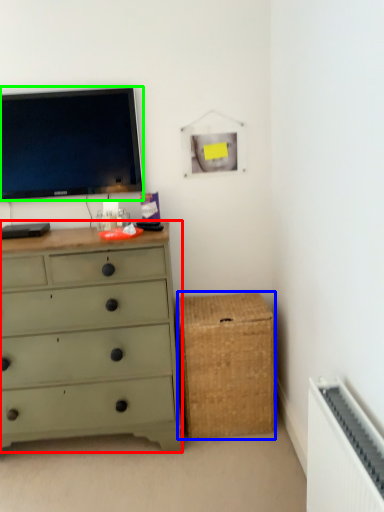
Question: Considering the real-world distances, which object is farthest from chest of drawers (highlighted by a red box)? storage box (highlighted by a blue box) or television (highlighted by a green box)?

Choices:
 (A) storage box
 (B) television

Answer: (B)